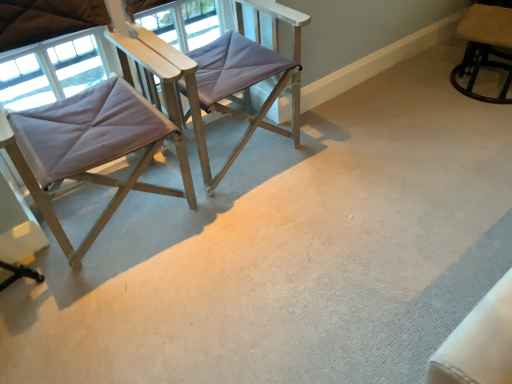
Locate an element on the screen. This screenshot has height=384, width=512. empty space that is in between beige fabric chair at upper right, which is counted as the 3th chair, starting from the left, and matte gray fabric chair at left, marked as the first chair in a left-to-right arrangement is located at coordinates (367, 135).